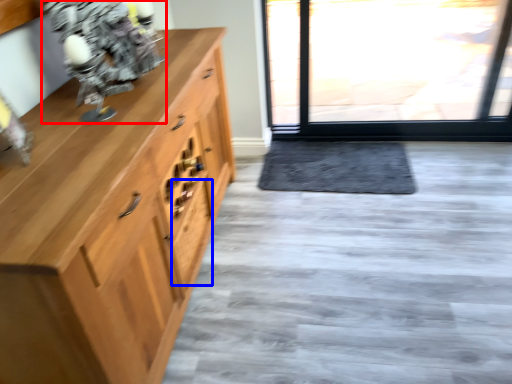
Question: Which object is further to the camera taking this photo, figurine (highlighted by a red box) or drawer (highlighted by a blue box)?

Choices:
 (A) figurine
 (B) drawer

Answer: (B)